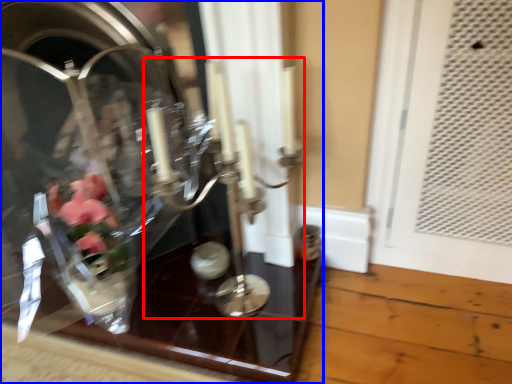
Question: Among these objects, which one is nearest to the camera, candle holder (highlighted by a red box) or glass box (highlighted by a blue box)?

Choices:
 (A) candle holder
 (B) glass box

Answer: (A)